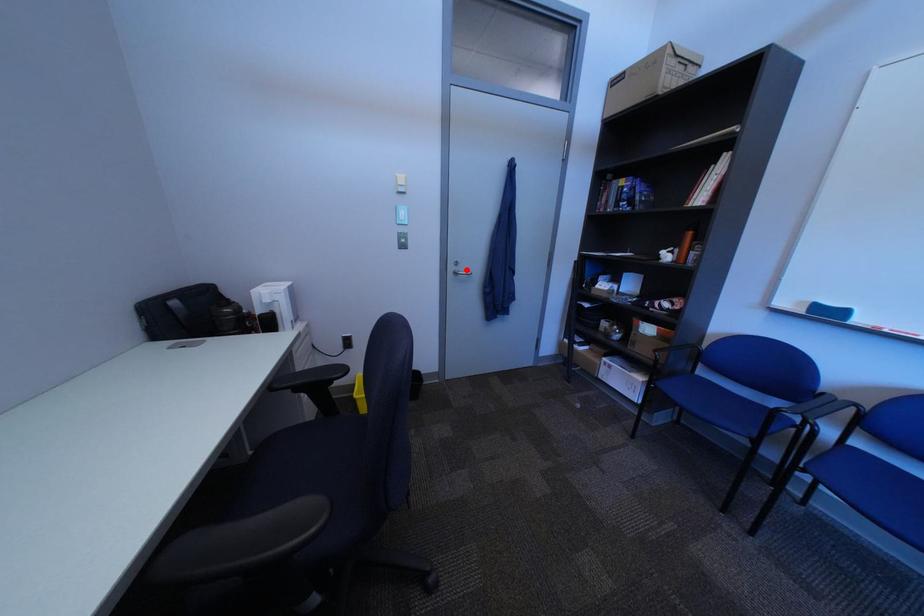
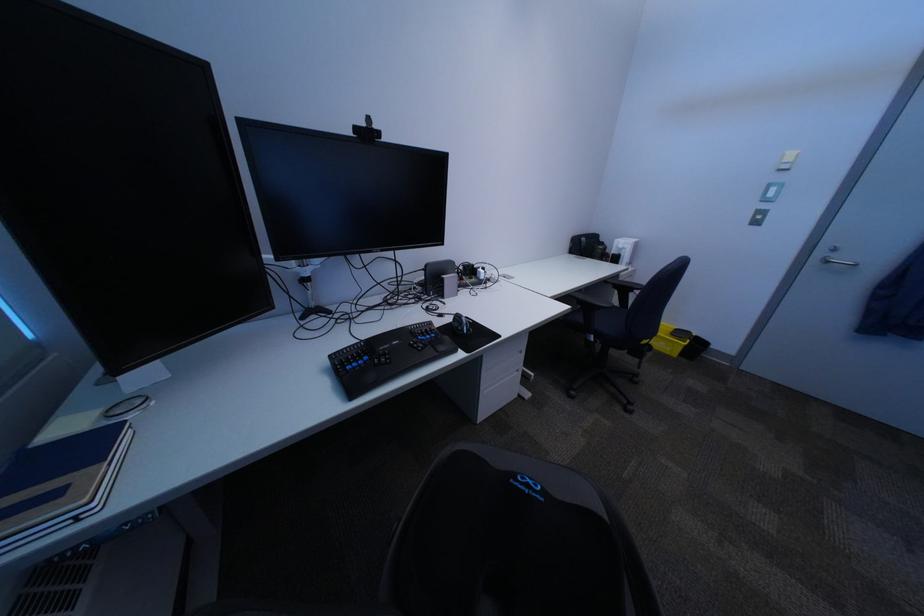
Question: I am providing you with two images of the same scene from different viewpoints. A red point is shown in image1. For the corresponding object point in image2, is it positioned nearer or farther from the camera?

Choices:
 (A) Nearer
 (B) Farther

Answer: (B)